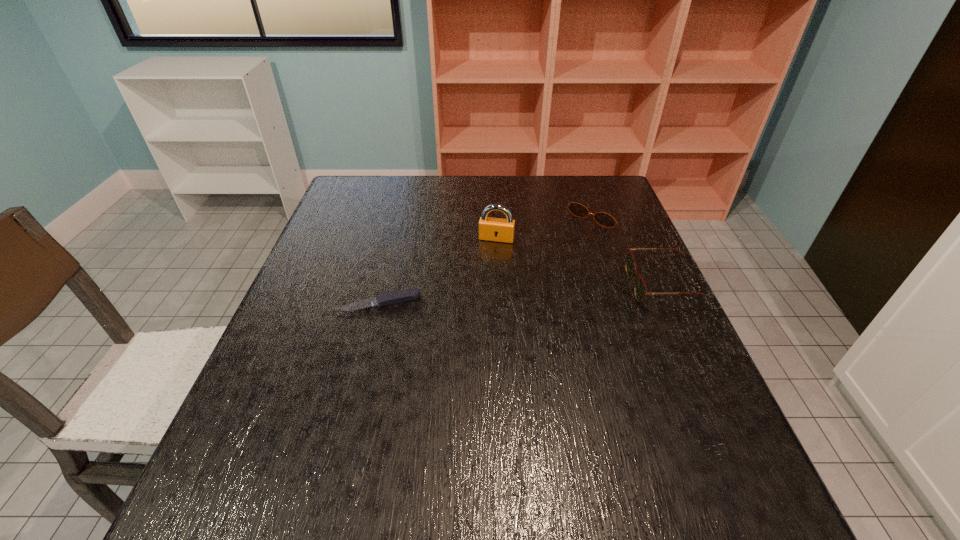
At what (x,y) coordinates should I click in order to perform the action: click on free region that satisfies the following two spatial constraints: 1. on the front side of the second tallest object; 2. at the front view of the second farthest object. Please return your answer as a coordinate pair (x, y). The image size is (960, 540). Looking at the image, I should click on (498, 286).